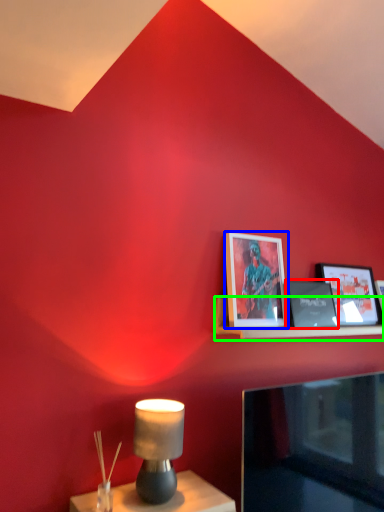
Question: Which object is positioned closest to picture frame (highlighted by a red box)? Select from picture frame (highlighted by a blue box) and shelf (highlighted by a green box).

Choices:
 (A) picture frame
 (B) shelf

Answer: (B)